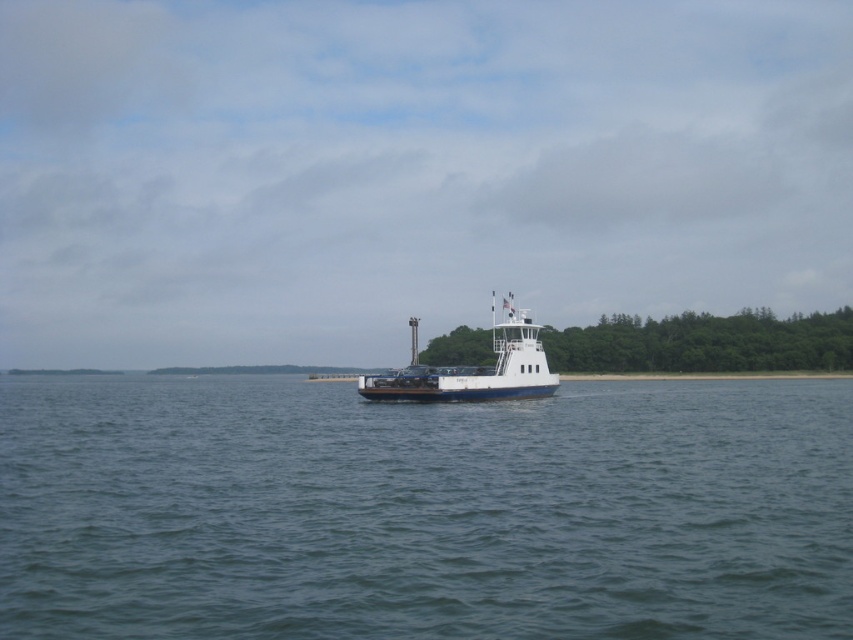
Question: Observing the image, what is the correct spatial positioning of blue water at center in reference to white glossy ferry at center?

Choices:
 (A) below
 (B) above

Answer: (A)

Question: Which point appears farthest from the camera in this image?

Choices:
 (A) (53, 588)
 (B) (375, 380)

Answer: (B)

Question: Which point is closer to the camera?

Choices:
 (A) blue water at center
 (B) white glossy ferry at center

Answer: (A)

Question: Can you confirm if blue water at center is positioned to the right of white glossy ferry at center?

Choices:
 (A) no
 (B) yes

Answer: (B)

Question: Is blue water at center wider than white glossy ferry at center?

Choices:
 (A) yes
 (B) no

Answer: (A)